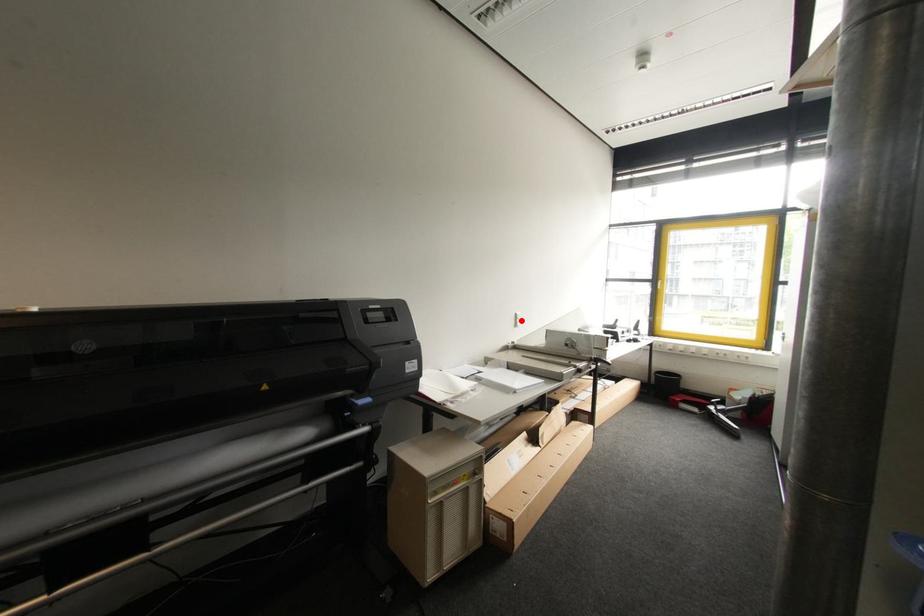
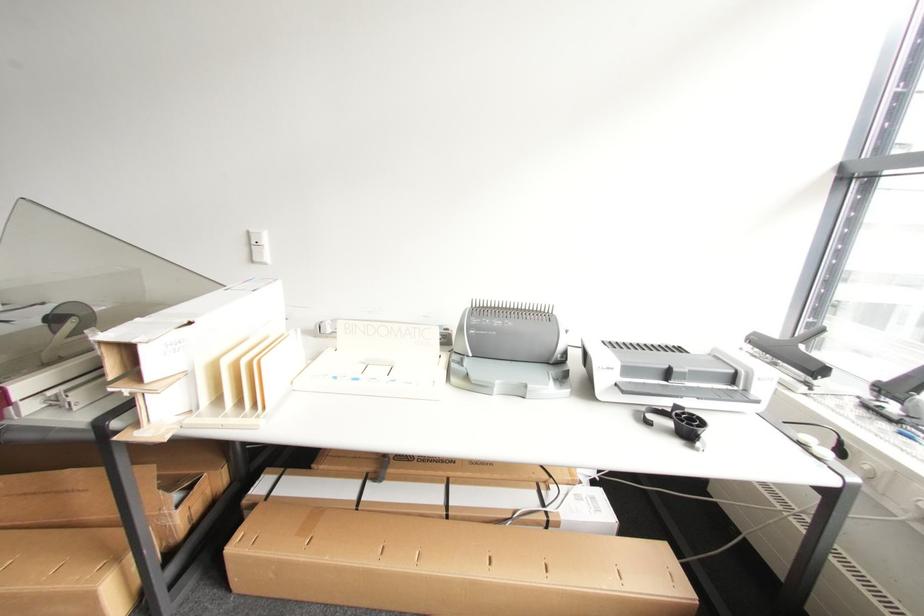
The point at the highlighted location is marked in the first image. Where is the corresponding point in the second image?

(257, 248)